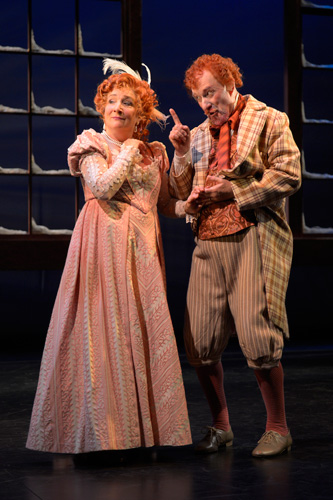
Locate an element on the screen. This screenshot has width=333, height=500. shoe is located at coordinates (210, 446), (272, 450).